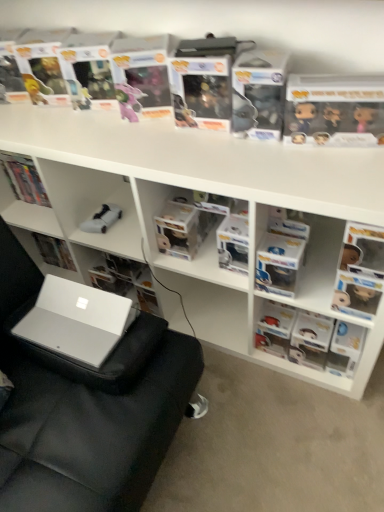
At what (x,y) coordinates should I click in order to perform the action: click on empty space that is ontop of clear plastic container at center, the second book viewed from the left. Please return your answer as a coordinate pair (x, y). This screenshot has height=512, width=384. Looking at the image, I should click on pos(185,202).